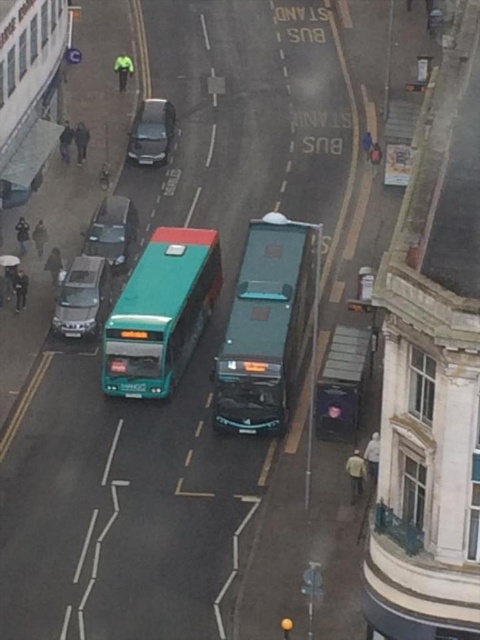
Is point (183, 324) more distant than point (99, 292)?

That is False.

From the picture: Can you confirm if teal matte bus at center is positioned above satin silver suv at left?

Indeed, teal matte bus at center is positioned over satin silver suv at left.

Is point (179, 364) in front of point (88, 273)?

That is True.

What are the coordinates of `teal matte bus at center` in the screenshot? It's located at (160, 312).

Does green matte bus at center appear on the right side of satin silver suv at left?

Correct, you'll find green matte bus at center to the right of satin silver suv at left.

Is point (269, 371) less distant than point (103, 285)?

Yes, point (269, 371) is in front of point (103, 285).

Where is `green matte bus at center`? The width and height of the screenshot is (480, 640). green matte bus at center is located at coordinates (265, 328).

Does metallic silver car at center-left lie behind metallic gray car at center?

That is False.

Between point (98, 212) and point (140, 138), which one is positioned behind?

Point (140, 138)

The height and width of the screenshot is (640, 480). Describe the element at coordinates (112, 230) in the screenshot. I see `metallic silver car at center-left` at that location.

You are a GUI agent. You are given a task and a screenshot of the screen. Output one action in this format:
    pyautogui.click(x=<x>, y=<y>)
    Task: Click on the metallic silver car at center-left
    The width and height of the screenshot is (480, 640).
    Given the screenshot: What is the action you would take?
    pyautogui.click(x=112, y=230)